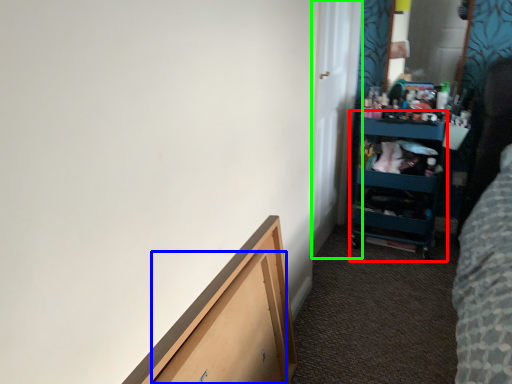
Question: Estimate the real-world distances between objects in this image. Which object is closer to cabinet (highlighted by a red box), drawer (highlighted by a blue box) or door (highlighted by a green box)?

Choices:
 (A) drawer
 (B) door

Answer: (B)